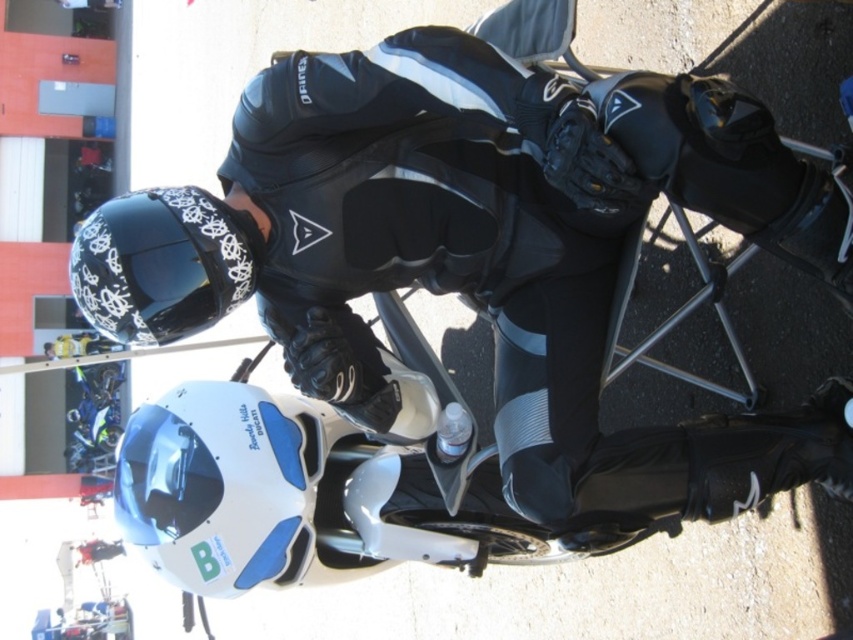
Question: Can you confirm if black leather motorcycle rider at center is thinner than white matte helmet at lower center?

Choices:
 (A) yes
 (B) no

Answer: (B)

Question: Does black leather motorcycle rider at center come behind white matte helmet at lower center?

Choices:
 (A) yes
 (B) no

Answer: (B)

Question: Which point is farther to the camera?

Choices:
 (A) (106, 292)
 (B) (151, 340)
 (C) (247, 394)

Answer: (C)

Question: Does black leather motorcycle rider at center appear on the right side of white matte helmet at lower center?

Choices:
 (A) yes
 (B) no

Answer: (A)

Question: Which of the following is the farthest from the observer?

Choices:
 (A) white matte helmet at lower center
 (B) black leather motorcycle rider at center

Answer: (A)

Question: Which object is closer to the camera taking this photo?

Choices:
 (A) black glossy helmet at upper left
 (B) black leather motorcycle rider at center
 (C) white matte helmet at lower center

Answer: (B)